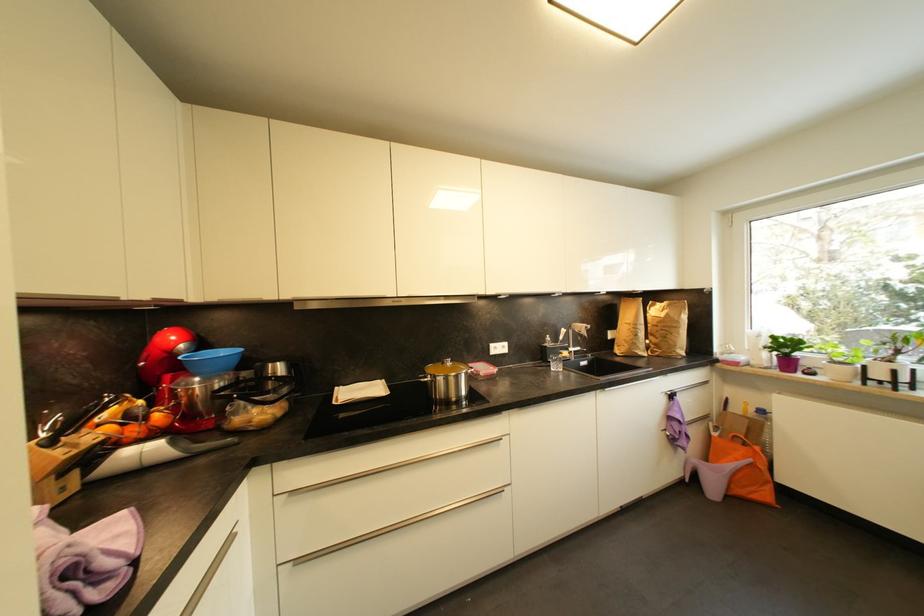
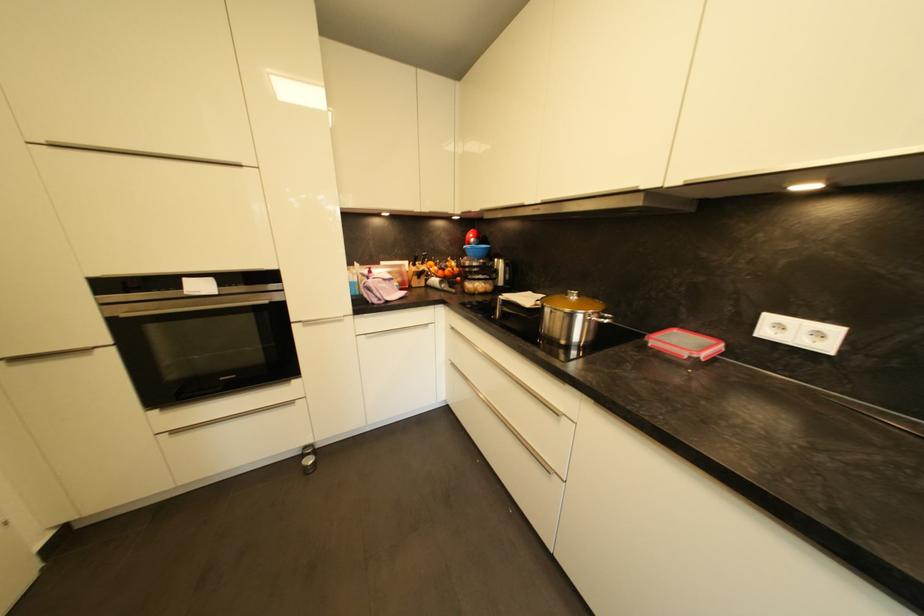
In the second image, find the point that corresponds to point (456, 363) in the first image.

(584, 298)